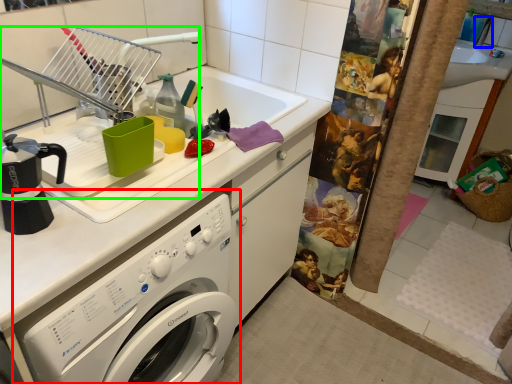
Question: Which object is positioned farthest from washing machine (highlighted by a red box)? Select from faucet (highlighted by a blue box) and appliance (highlighted by a green box).

Choices:
 (A) faucet
 (B) appliance

Answer: (A)